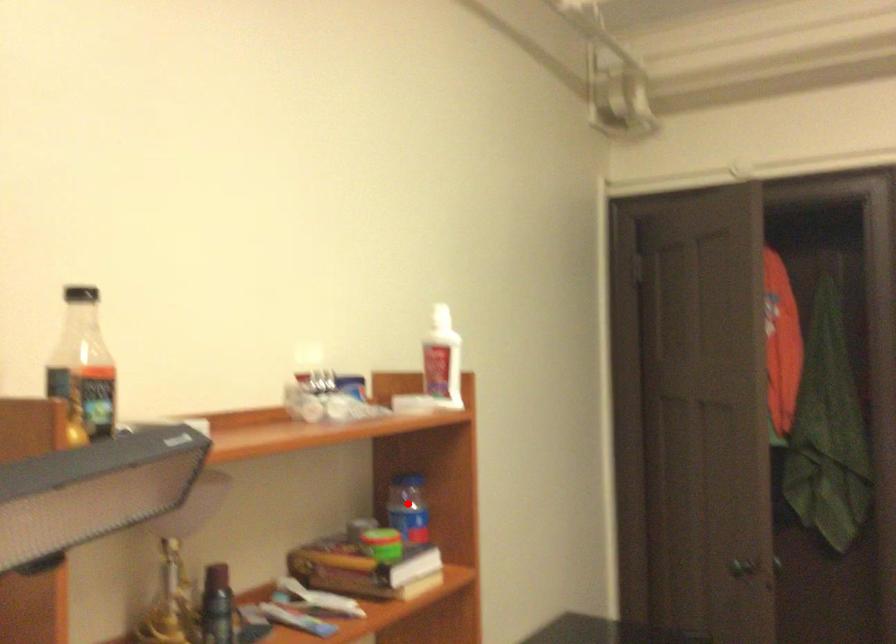
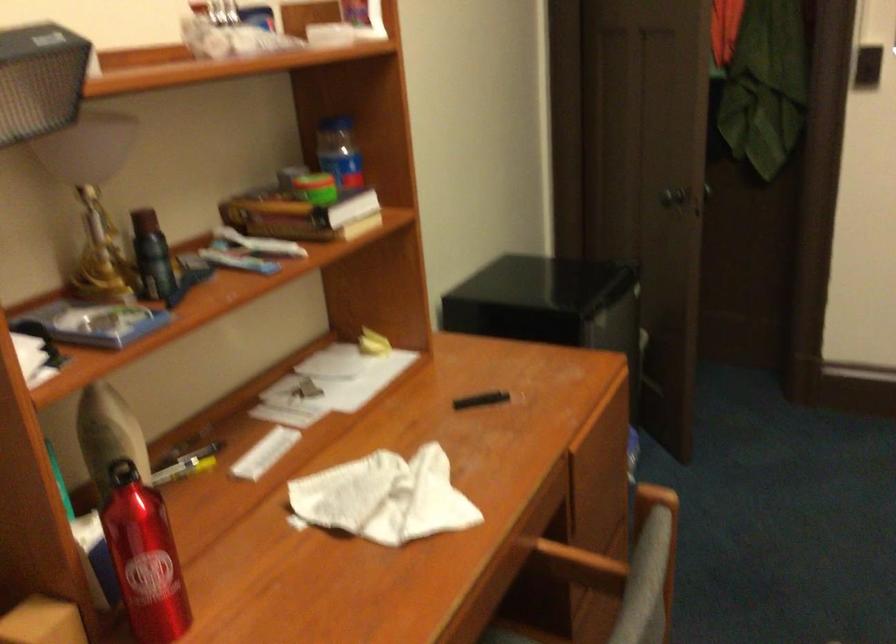
In the second image, find the point that corresponds to the highlighted location in the first image.

(339, 152)